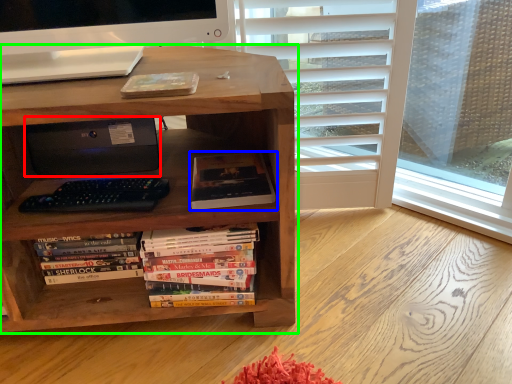
Question: Based on their relative distances, which object is nearer to printer (highlighted by a red box)? Choose from book (highlighted by a blue box) and bookcase (highlighted by a green box).

Choices:
 (A) book
 (B) bookcase

Answer: (B)